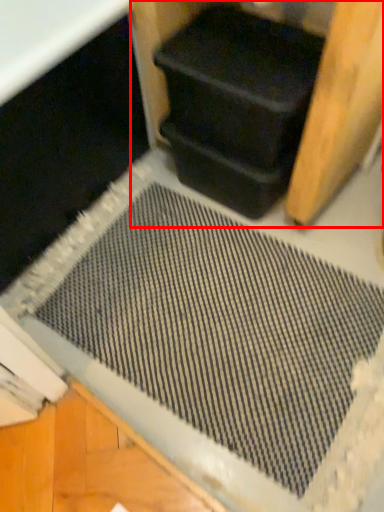
Question: From the image's perspective, what is the correct spatial positioning of wood (annotated by the red box) in reference to wide?

Choices:
 (A) above
 (B) below

Answer: (A)